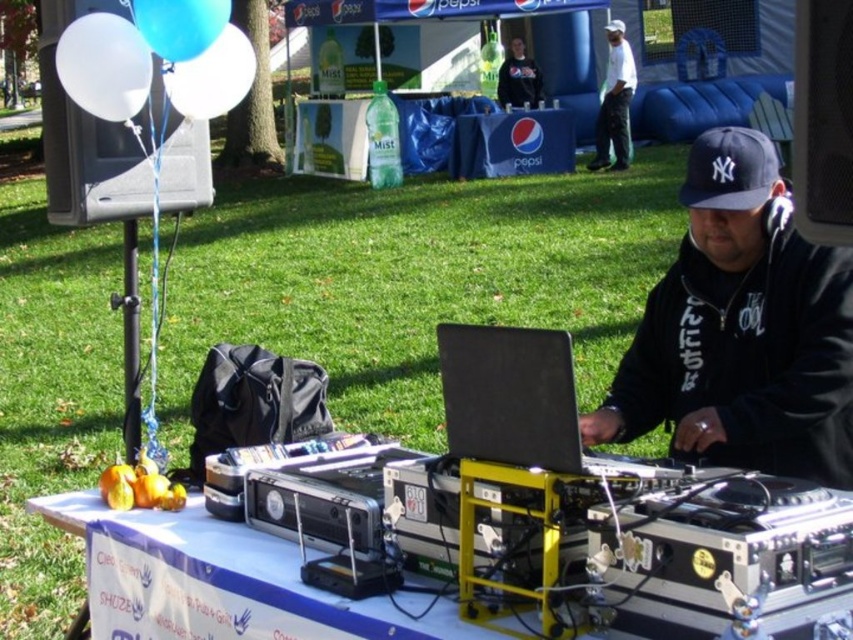
Does white matte balloon at upper left appear on the left side of white cotton shirt at upper center?

Yes, white matte balloon at upper left is to the left of white cotton shirt at upper center.

Is point (102, 99) closer to viewer compared to point (607, 60)?

Yes, it is.

Locate an element on the screen. Image resolution: width=853 pixels, height=640 pixels. white matte balloon at upper left is located at coordinates (103, 65).

Which is behind, point (566, 124) or point (769, 152)?

The point (566, 124) is behind.

Is blue fabric pepsi banner at upper center above black fabric baseball cap at center?

Indeed, blue fabric pepsi banner at upper center is positioned over black fabric baseball cap at center.

I want to click on blue fabric pepsi banner at upper center, so click(x=514, y=144).

The image size is (853, 640). Identify the location of blue fabric pepsi banner at upper center. (514, 144).

Does blue glossy balloon at upper left have a greater height compared to black fabric baseball cap at upper center?

Yes, blue glossy balloon at upper left is taller than black fabric baseball cap at upper center.

Consider the image. Is blue glossy balloon at upper left smaller than black fabric baseball cap at upper center?

Yes, blue glossy balloon at upper left is smaller than black fabric baseball cap at upper center.

This screenshot has height=640, width=853. In order to click on blue glossy balloon at upper left in this screenshot , I will do `click(212, 76)`.

This screenshot has width=853, height=640. In order to click on blue glossy balloon at upper left in this screenshot , I will do `click(212, 76)`.